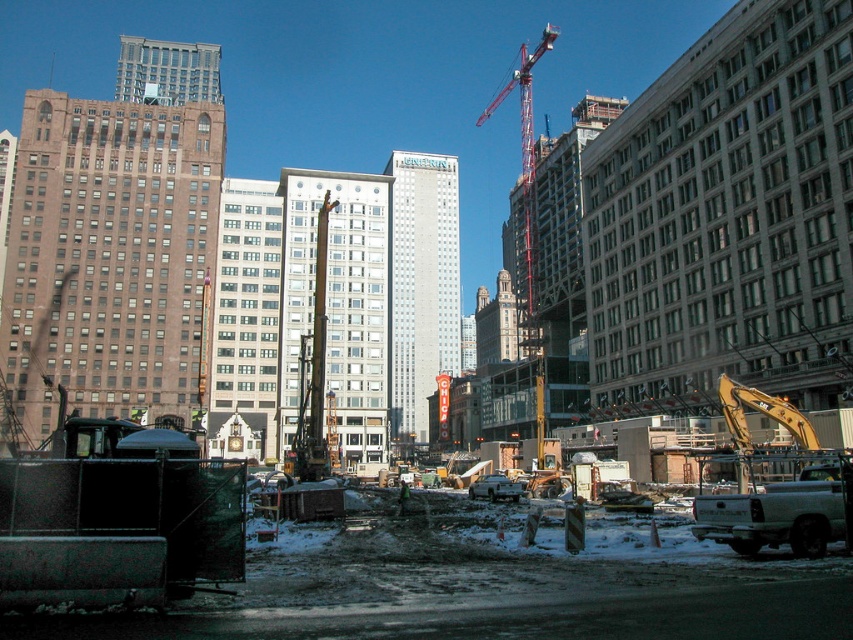
Question: Does metallic yellow excavator at center have a greater width compared to red metal crane at upper center?

Choices:
 (A) yes
 (B) no

Answer: (B)

Question: Estimate the real-world distances between objects in this image. Which object is farther from the red metal crane at upper center?

Choices:
 (A) metallic yellow excavator at center
 (B) green fabric construction worker at center

Answer: (B)

Question: Does metallic yellow excavator at center have a larger size compared to green fabric construction worker at center?

Choices:
 (A) no
 (B) yes

Answer: (B)

Question: Among these objects, which one is nearest to the camera?

Choices:
 (A) green fabric construction worker at center
 (B) red metal crane at upper center

Answer: (A)

Question: Is the position of metallic yellow excavator at center less distant than that of green fabric construction worker at center?

Choices:
 (A) no
 (B) yes

Answer: (A)

Question: Considering the real-world distances, which object is closest to the green fabric construction worker at center?

Choices:
 (A) red metal crane at upper center
 (B) metallic yellow excavator at center

Answer: (B)